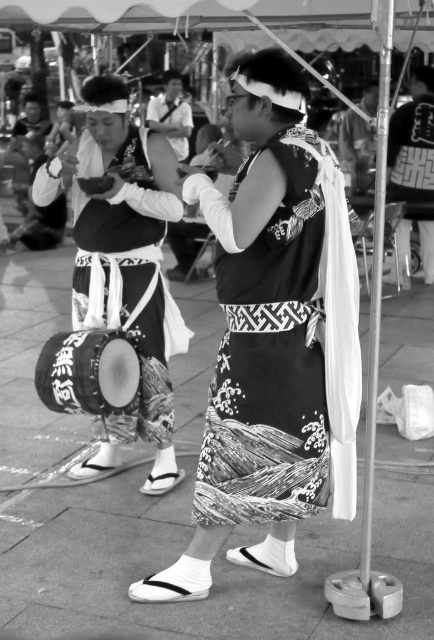
You are a photographer standing at the camera position in the scene. You want to take a closeup photo of the black fabric drum at left. However, you can only move forward 3 meters. Will you be able to get close enough to take the closeup?

The black fabric drum at left is 4.25 meters away from the camera. Moving forward 3 meters would bring you to 1.25 meters away from the drum, so yes, you can get close enough to take the closeup.

You are organizing a cultural event and need to arrange the black printed fabric dress at center and the black fabric drum at left in a display case. The display case has limited space. Which object should you prioritize placing first to ensure both fit?

The black printed fabric dress at center occupies less space than the black fabric drum at left, so you should place the larger black fabric drum at left first to ensure both fit in the display case.